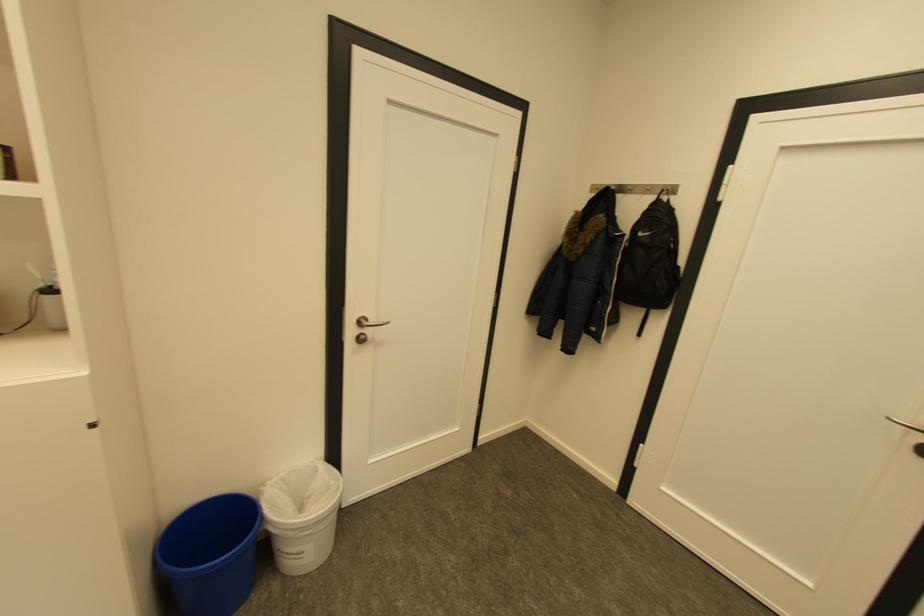
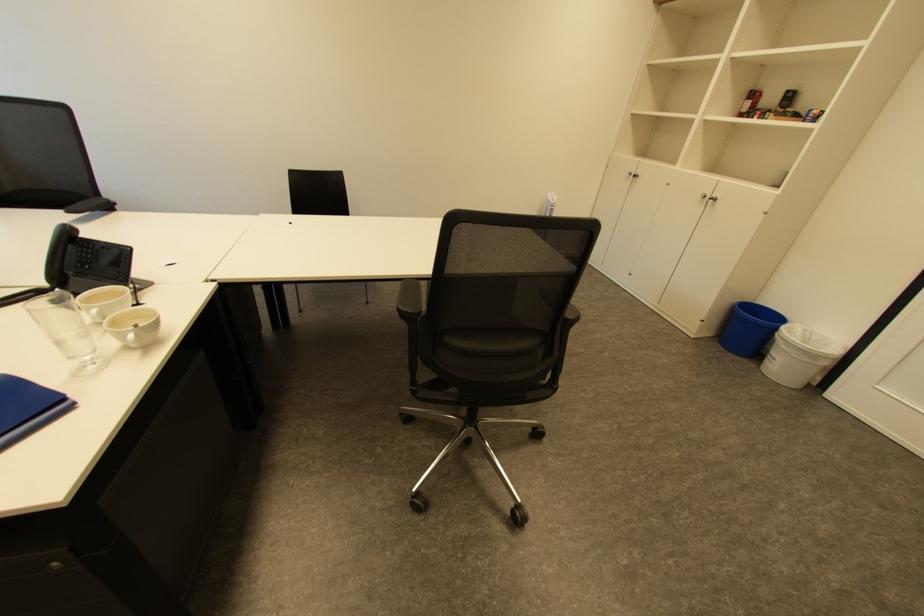
Find the pixel in the second image that matches point (283, 583) in the first image.

(760, 365)